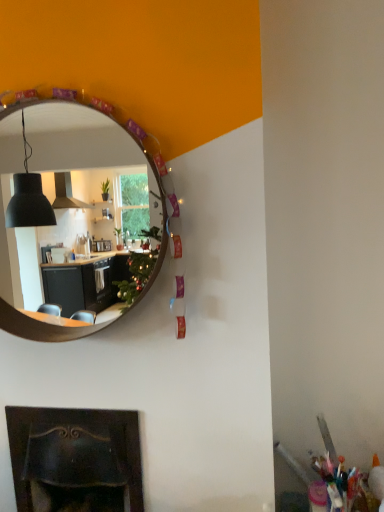
Find the location of a particular element. The width and height of the screenshot is (384, 512). wooden mirror at upper center is located at coordinates (81, 161).

Describe the element at coordinates (81, 161) in the screenshot. I see `wooden mirror at upper center` at that location.

What do you see at coordinates (75, 459) in the screenshot?
I see `dark brown wood fireplace at lower left` at bounding box center [75, 459].

Identify the location of dark brown wood fireplace at lower left. This screenshot has width=384, height=512. (75, 459).

You are a GUI agent. You are given a task and a screenshot of the screen. Output one action in this format:
    pyautogui.click(x=<x>, y=<y>)
    Task: Click on the wooden mirror at upper center
    The height and width of the screenshot is (512, 384).
    Given the screenshot: What is the action you would take?
    pyautogui.click(x=81, y=161)

Is wooden mirror at upper center at the right side of dark brown wood fireplace at lower left?

Yes.

Is wooden mirror at upper center positioned before dark brown wood fireplace at lower left?

Yes, it is in front of dark brown wood fireplace at lower left.

Is point (76, 303) positioned behind point (41, 469)?

Yes, point (76, 303) is farther from viewer.

From the image's perspective, who appears lower, wooden mirror at upper center or dark brown wood fireplace at lower left?

dark brown wood fireplace at lower left appears lower in the image.

From a real-world perspective, who is located lower, wooden mirror at upper center or dark brown wood fireplace at lower left?

dark brown wood fireplace at lower left, from a real-world perspective.

In terms of width, does wooden mirror at upper center look wider or thinner when compared to dark brown wood fireplace at lower left?

Clearly, wooden mirror at upper center has less width compared to dark brown wood fireplace at lower left.

Considering the sizes of objects wooden mirror at upper center and dark brown wood fireplace at lower left in the image provided, who is taller, wooden mirror at upper center or dark brown wood fireplace at lower left?

wooden mirror at upper center.

Is wooden mirror at upper center smaller than dark brown wood fireplace at lower left?

Indeed, wooden mirror at upper center has a smaller size compared to dark brown wood fireplace at lower left.

Is wooden mirror at upper center positioned beyond the bounds of dark brown wood fireplace at lower left?

wooden mirror at upper center is positioned outside dark brown wood fireplace at lower left.

Is the surface of wooden mirror at upper center in direct contact with dark brown wood fireplace at lower left?

wooden mirror at upper center and dark brown wood fireplace at lower left are not in contact.

Is dark brown wood fireplace at lower left at the back of wooden mirror at upper center?

wooden mirror at upper center does not have its back to dark brown wood fireplace at lower left.

Can you tell me how much wooden mirror at upper center and dark brown wood fireplace at lower left differ in facing direction?

The facing directions of wooden mirror at upper center and dark brown wood fireplace at lower left are 1.09 degrees apart.

How far apart are wooden mirror at upper center and dark brown wood fireplace at lower left?

2.34 meters.

This screenshot has width=384, height=512. In the image, there is a wooden mirror at upper center. Find the location of `fireplace below it (from the image's perspective)`. fireplace below it (from the image's perspective) is located at coordinates pos(75,459).

Is dark brown wood fireplace at lower left at the left side of wooden mirror at upper center?

Yes.

Consider the image. Does dark brown wood fireplace at lower left lie behind wooden mirror at upper center?

Yes, dark brown wood fireplace at lower left is further from the viewer.

Is point (123, 436) closer or farther from the camera than point (78, 189)?

Point (123, 436) appears to be closer to the viewer than point (78, 189).

From the image's perspective, which object appears higher, dark brown wood fireplace at lower left or wooden mirror at upper center?

wooden mirror at upper center, from the image's perspective.

From a real-world perspective, who is located higher, dark brown wood fireplace at lower left or wooden mirror at upper center?

wooden mirror at upper center is physically above.

Consider the image. Considering the relative sizes of dark brown wood fireplace at lower left and wooden mirror at upper center in the image provided, is dark brown wood fireplace at lower left thinner than wooden mirror at upper center?

In fact, dark brown wood fireplace at lower left might be wider than wooden mirror at upper center.

In terms of height, does dark brown wood fireplace at lower left look taller or shorter compared to wooden mirror at upper center?

In the image, dark brown wood fireplace at lower left appears to be shorter than wooden mirror at upper center.

Based on the photo, is dark brown wood fireplace at lower left smaller than wooden mirror at upper center?

No, dark brown wood fireplace at lower left is not smaller than wooden mirror at upper center.

Is dark brown wood fireplace at lower left completely or partially outside of wooden mirror at upper center?

Yes.

Is dark brown wood fireplace at lower left far from wooden mirror at upper center?

dark brown wood fireplace at lower left is far away from wooden mirror at upper center.

Is dark brown wood fireplace at lower left oriented towards wooden mirror at upper center?

No, dark brown wood fireplace at lower left is not aimed at wooden mirror at upper center.

How far apart are dark brown wood fireplace at lower left and wooden mirror at upper center?

dark brown wood fireplace at lower left is 2.34 meters away from wooden mirror at upper center.

Find the location of a particular element. Image resolution: width=384 pixels, height=512 pixels. fireplace that is below the wooden mirror at upper center (from the image's perspective) is located at coordinates (75, 459).

Locate an element on the screen. This screenshot has height=512, width=384. mirror that appears in front of the dark brown wood fireplace at lower left is located at coordinates (81, 161).

Locate an element on the screen. This screenshot has height=512, width=384. fireplace located underneath the wooden mirror at upper center (from a real-world perspective) is located at coordinates (75, 459).